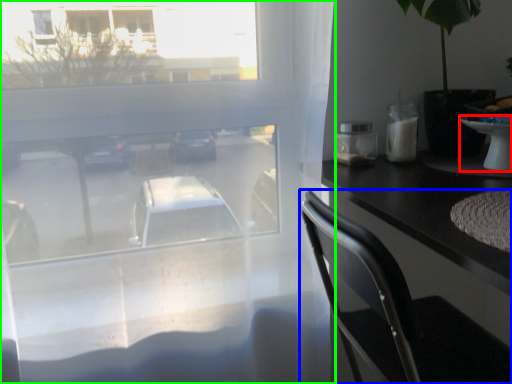
Question: Considering the real-world distances, which object is farthest from table (highlighted by a red box)? chair (highlighted by a blue box) or window (highlighted by a green box)?

Choices:
 (A) chair
 (B) window

Answer: (B)